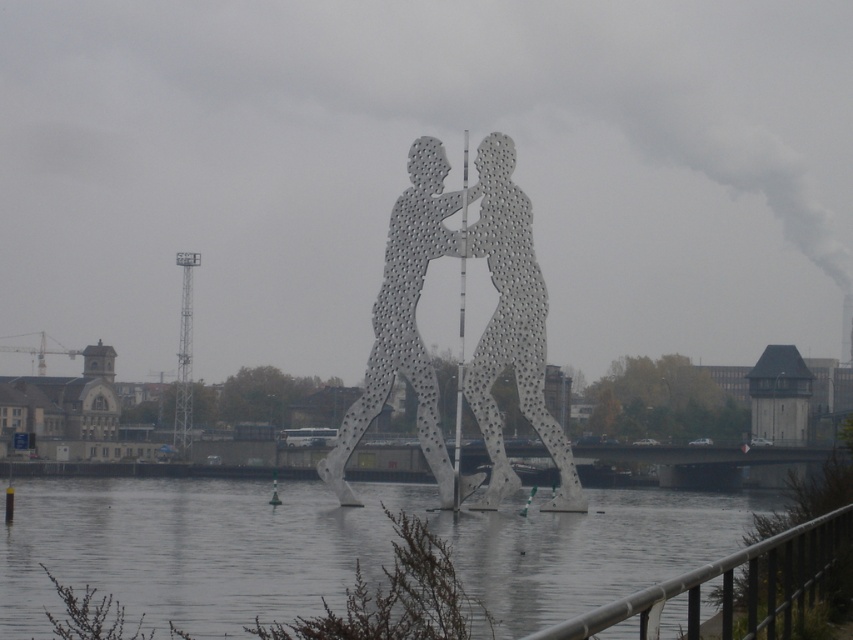
As an architect analyzing the sculpture, you need to note the exact position of the gray metallic water at center in the image. What are its coordinates?

→ The gray metallic water at center is located at coordinates point (190, 547).

You are standing near the sculpture and want to reach the point at coordinates (529, 392). If your maximum comfortable walking distance is 300 feet, will you be able to comfortably walk to that point?

The point at coordinates (529, 392) is 329.22 feet away from the viewer, which exceeds the maximum comfortable walking distance of 300 feet. Therefore, it may not be comfortable to walk to that point.

You are a tourist standing on the bank of the river, looking at the gray metallic water at center and the metallic perforated sculpture at center. Which object is closer to you?

The gray metallic water at center is closer to you because it is in front of the metallic perforated sculpture at center.